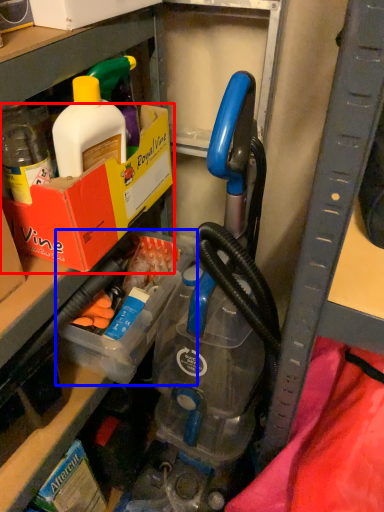
Question: Which object appears closest to the camera in this image, box (highlighted by a red box) or storage box (highlighted by a blue box)?

Choices:
 (A) box
 (B) storage box

Answer: (A)